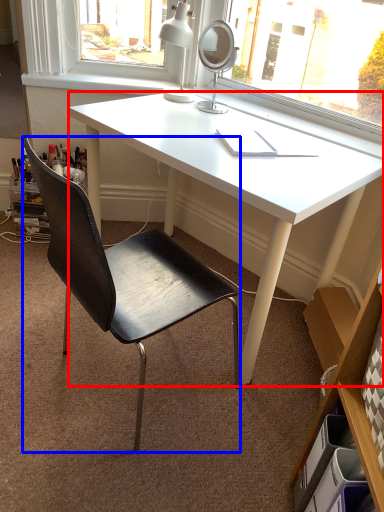
Question: Among these objects, which one is farthest to the camera, desk (highlighted by a red box) or chair (highlighted by a blue box)?

Choices:
 (A) desk
 (B) chair

Answer: (A)